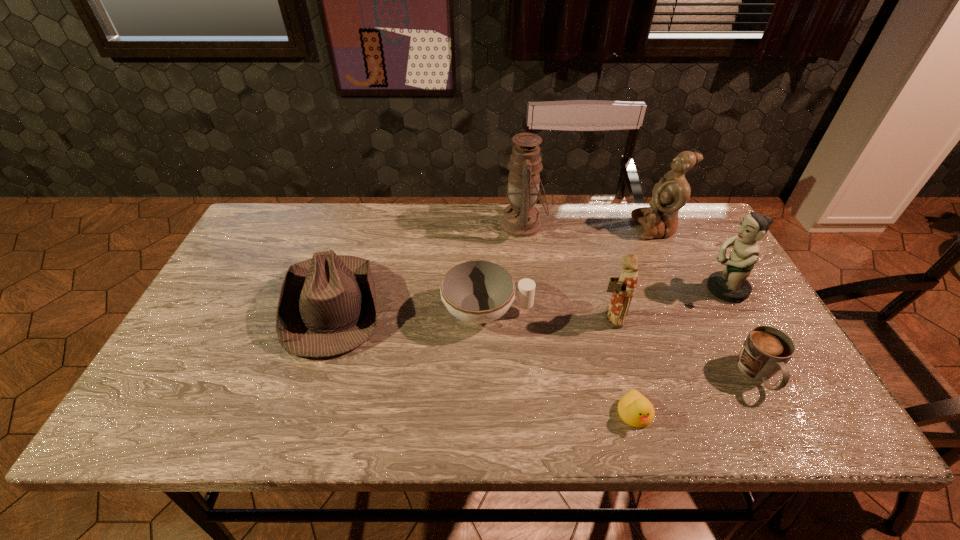
Identify the location of unoccupied position between the second farthest figurine and the duckling. (680, 352).

This screenshot has width=960, height=540. What are the coordinates of `vacant space in between the shortest object and the farthest figurine` in the screenshot? It's located at (645, 321).

Where is `blank region between the second farthest figurine and the mug`? Image resolution: width=960 pixels, height=540 pixels. blank region between the second farthest figurine and the mug is located at coordinates (741, 332).

This screenshot has width=960, height=540. Find the location of `unoccupied position between the chinaware and the fourth shortest object`. unoccupied position between the chinaware and the fourth shortest object is located at coordinates (411, 308).

Identify which object is located as the second nearest to the leftmost figurine. Please provide its 2D coordinates. Your answer should be formatted as a tuple, i.e. [(x, y)], where the tuple contains the x and y coordinates of a point satisfying the conditions above.

[(636, 410)]

Image resolution: width=960 pixels, height=540 pixels. In order to click on object that is the fourth closest to the tallest object in this screenshot , I will do `click(327, 306)`.

Image resolution: width=960 pixels, height=540 pixels. I want to click on figurine that is the second closest to the oil lamp, so click(x=671, y=193).

You are a GUI agent. You are given a task and a screenshot of the screen. Output one action in this format:
    pyautogui.click(x=<x>, y=<y>)
    Task: Click on the figurine object that ranks as the third closest to the mug
    
    Given the screenshot: What is the action you would take?
    pyautogui.click(x=671, y=193)

Where is `blank space that satisfies the following two spatial constraints: 1. on the front-facing side of the second farthest figurine; 2. on the side of the mug with the handle`? This screenshot has height=540, width=960. blank space that satisfies the following two spatial constraints: 1. on the front-facing side of the second farthest figurine; 2. on the side of the mug with the handle is located at coordinates (772, 375).